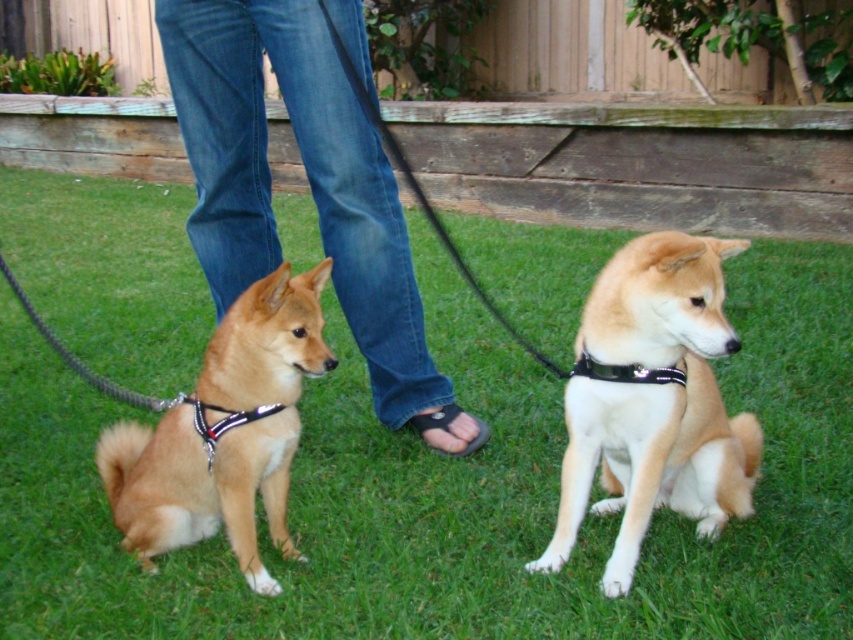
Question: Is green grass at lower center above jeans at center?

Choices:
 (A) yes
 (B) no

Answer: (B)

Question: Is green grass at lower center to the right of black leather collar at center from the viewer's perspective?

Choices:
 (A) no
 (B) yes

Answer: (A)

Question: Does green grass at lower center come behind black leather collar at center?

Choices:
 (A) yes
 (B) no

Answer: (B)

Question: Which point appears farthest from the camera in this image?

Choices:
 (A) (801, 349)
 (B) (669, 365)
 (C) (349, 28)

Answer: (A)

Question: Which point appears farthest from the camera in this image?

Choices:
 (A) (264, 348)
 (B) (567, 246)

Answer: (B)

Question: Which is farther from the black leather collar at center?

Choices:
 (A) jeans at center
 (B) golden fur dog at left
 (C) green grass at lower center

Answer: (A)